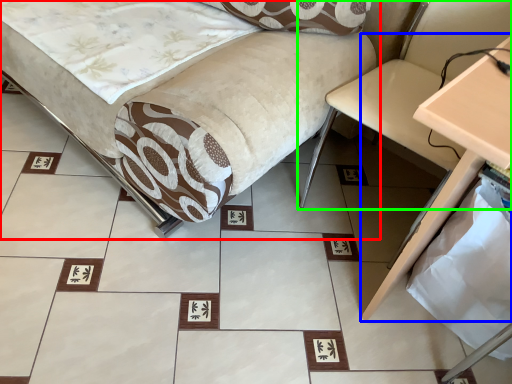
Question: Based on their relative distances, which object is farther from furniture (highlighted by a red box)? Choose from table (highlighted by a blue box) and swivel chair (highlighted by a green box).

Choices:
 (A) table
 (B) swivel chair

Answer: (A)